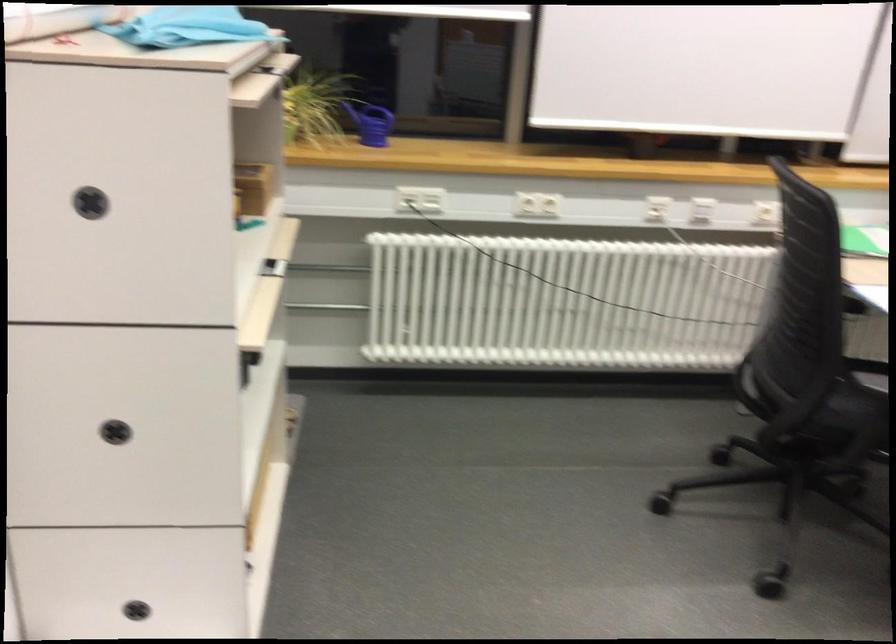
Find where to lift the blue watering can. Please return your answer as a coordinate pair (x, y).

(371, 122)